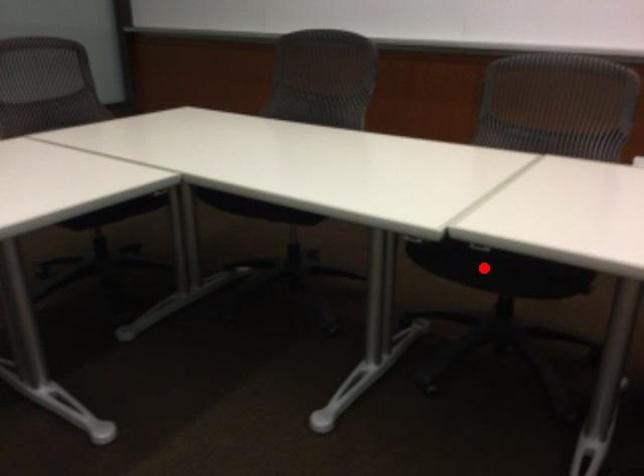
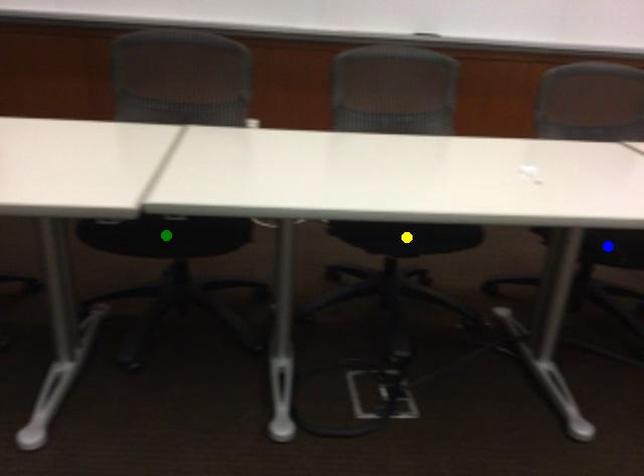
Question: I am providing you with two images of the same scene from different viewpoints. A red point is marked on the first image. You are given multiple points on the second image. Which mark in image 2 goes with the point in image 1?

Choices:
 (A) yellow point
 (B) green point
 (C) blue point

Answer: (B)